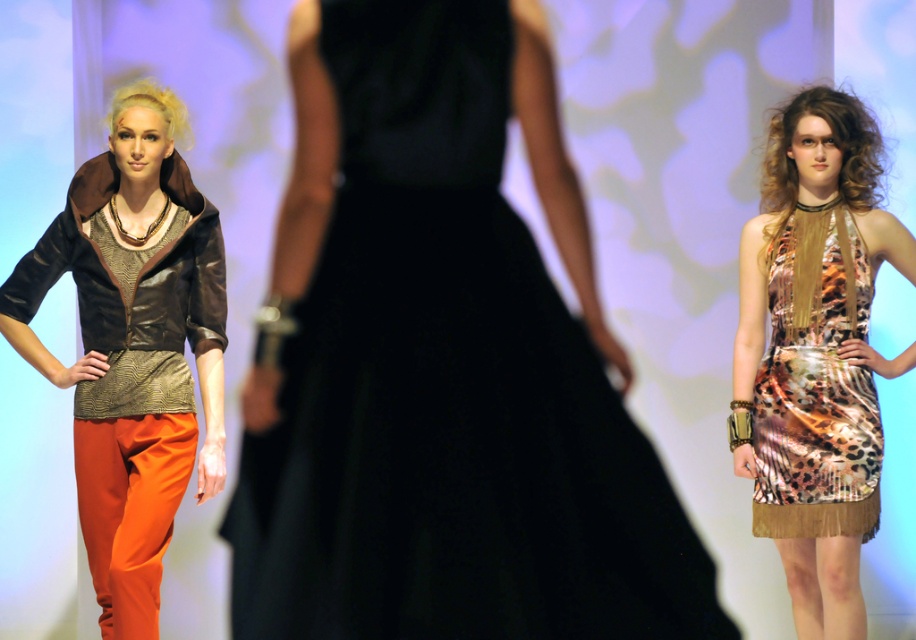
You are standing on the runway and see two points marked in the image. Which point is closer to you, point (791,205) or point (807,483)?

Point (791,205) is closer to you because it is further to the viewer than point (807,483).

You are a photographer at a fashion show. You need to capture a shot where both the matte brown leather jacket at left and the leopard print satin dress at right are visible. Based on their positions, which direction should you move to ensure both are in frame?

Since the matte brown leather jacket at left is to the left of the leopard print satin dress at right, you should move to the left to ensure both are visible in the frame.